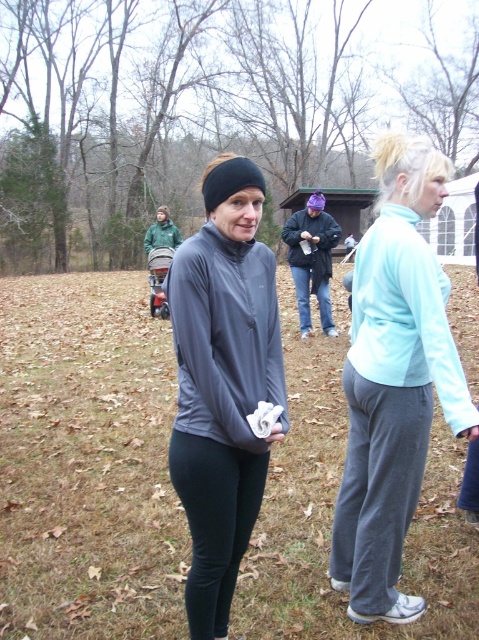
Based on the scene description, which object is shorter in height between the gray sweatpants at lower right and the dark gray fleece sweatshirt at center?

The gray sweatpants at lower right has a lesser height compared to the dark gray fleece sweatshirt at center, so the gray sweatpants at lower right is shorter in height.

You are standing at the center of the image and want to place a small decoration exactly at the position of the gray sweatpants at lower right. According to the coordinates provided, where should you place it?

The gray sweatpants at lower right is located at point (377, 486), so you should place the decoration at those coordinates.

In the scene shown: You are a fashion designer observing the two women in the scene. You need to determine which clothing item has a greater width between the matte gray sweatshirt at center and the black matte leggings at center. Which one is wider?

The matte gray sweatshirt at center is wider than the black matte leggings at center according to the description.